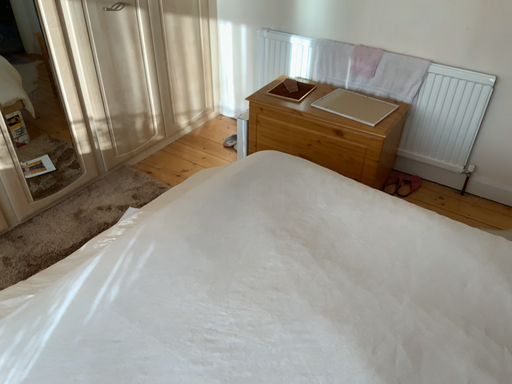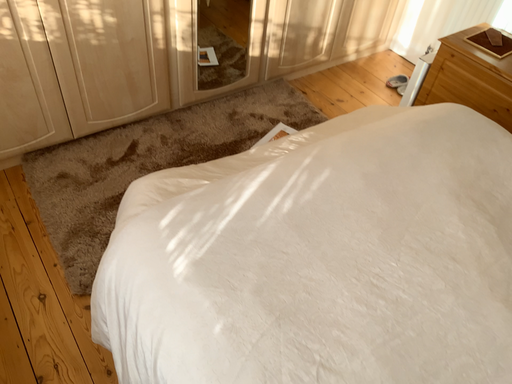
Question: How did the camera likely rotate when shooting the video?

Choices:
 (A) rotated right
 (B) rotated left

Answer: (B)